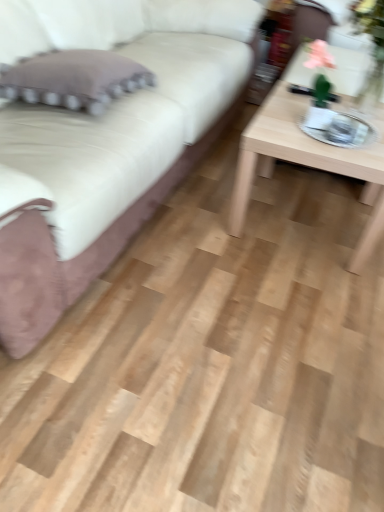
Question: Considering the relative sizes of purple fabric pillow at left and velvet beige couch at upper left in the image provided, is purple fabric pillow at left shorter than velvet beige couch at upper left?

Choices:
 (A) no
 (B) yes

Answer: (B)

Question: Does purple fabric pillow at left have a greater width compared to velvet beige couch at upper left?

Choices:
 (A) no
 (B) yes

Answer: (A)

Question: Can you confirm if purple fabric pillow at left is positioned to the right of velvet beige couch at upper left?

Choices:
 (A) yes
 (B) no

Answer: (A)

Question: Would you say velvet beige couch at upper left is part of purple fabric pillow at left's contents?

Choices:
 (A) no
 (B) yes

Answer: (A)

Question: Is purple fabric pillow at left closer to the viewer compared to velvet beige couch at upper left?

Choices:
 (A) no
 (B) yes

Answer: (A)

Question: Is purple fabric pillow at left next to velvet beige couch at upper left and touching it?

Choices:
 (A) yes
 (B) no

Answer: (B)

Question: Is the position of light wood/texture coffee table at right more distant than that of velvet beige couch at upper left?

Choices:
 (A) no
 (B) yes

Answer: (B)

Question: Is light wood/texture coffee table at right looking in the opposite direction of velvet beige couch at upper left?

Choices:
 (A) no
 (B) yes

Answer: (B)

Question: Is velvet beige couch at upper left surrounded by light wood/texture coffee table at right?

Choices:
 (A) yes
 (B) no

Answer: (B)

Question: From the image's perspective, is light wood/texture coffee table at right located beneath velvet beige couch at upper left?

Choices:
 (A) no
 (B) yes

Answer: (B)

Question: Can you see light wood/texture coffee table at right touching velvet beige couch at upper left?

Choices:
 (A) yes
 (B) no

Answer: (B)

Question: Is light wood/texture coffee table at right bigger than velvet beige couch at upper left?

Choices:
 (A) no
 (B) yes

Answer: (A)

Question: Can you confirm if velvet beige couch at upper left is wider than purple fabric pillow at left?

Choices:
 (A) no
 (B) yes

Answer: (B)